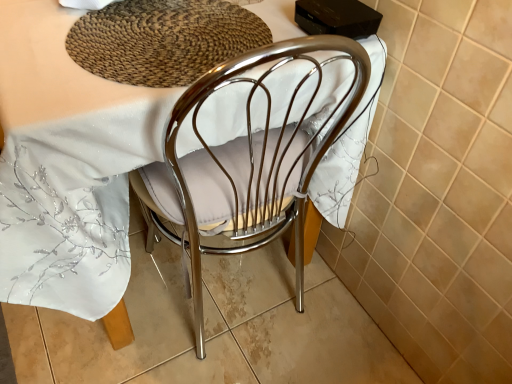
This screenshot has height=384, width=512. Identify the location of free location above woven brown mat at upper center (from a real-world perspective). (168, 34).